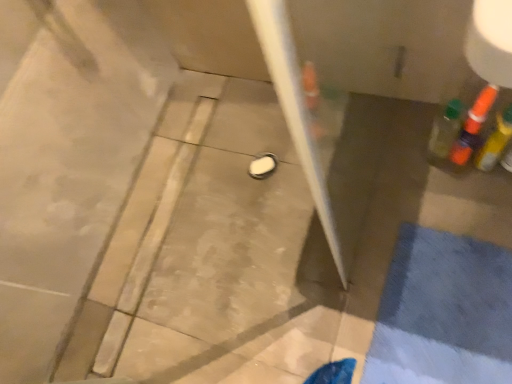
Where is `free space to the left of translucent plastic bottle at right, the third bottle positioned from the right`? free space to the left of translucent plastic bottle at right, the third bottle positioned from the right is located at coordinates (394, 184).